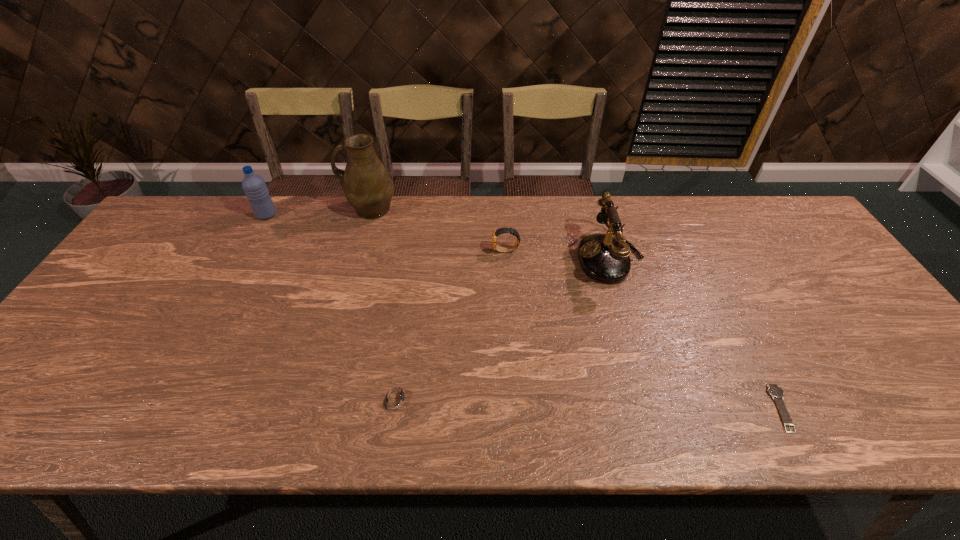
Locate an element on the screen. The width and height of the screenshot is (960, 540). vacant area situated 0.210m on the face of the second tallest watch is located at coordinates (513, 398).

The image size is (960, 540). Find the location of `vacant space located 0.260m on the back of the shortest object`. vacant space located 0.260m on the back of the shortest object is located at coordinates (725, 298).

Identify the location of pitcher located at the far edge. pos(367,185).

Locate an element on the screen. water bottle positioned at the far edge is located at coordinates point(254,186).

This screenshot has width=960, height=540. Identify the location of telephone present at the far edge. (602, 257).

The image size is (960, 540). In the image, there is a desktop. What are the coordinates of `vacant space at the far edge` in the screenshot? It's located at (691, 229).

Identify the location of vacant area at the near edge of the desktop. (681, 418).

Locate an element on the screen. This screenshot has width=960, height=540. vacant space at the left edge is located at coordinates (106, 291).

You are a GUI agent. You are given a task and a screenshot of the screen. Output one action in this format:
    pyautogui.click(x=<x>, y=<y>)
    Task: Click on the vacant space at the right edge of the desktop
    This screenshot has width=960, height=540.
    Given the screenshot: What is the action you would take?
    pyautogui.click(x=799, y=249)

You are a GUI agent. You are given a task and a screenshot of the screen. Output one action in this format:
    pyautogui.click(x=<x>, y=<y>)
    Task: Click on the free location at the far left corner of the desktop
    
    Given the screenshot: What is the action you would take?
    pyautogui.click(x=196, y=242)